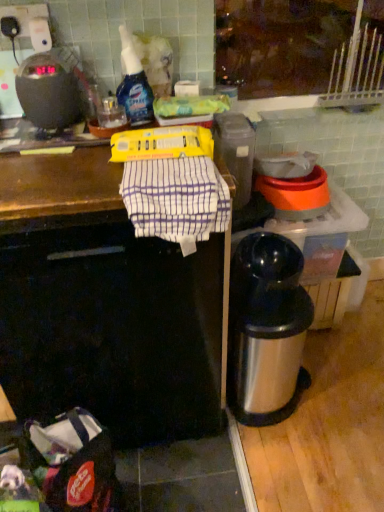
Question: From the image's perspective, would you say white striped cloth at center is positioned over silver metallic thermos at lower right?

Choices:
 (A) no
 (B) yes

Answer: (B)

Question: Is white striped cloth at center positioned beyond the bounds of silver metallic thermos at lower right?

Choices:
 (A) no
 (B) yes

Answer: (B)

Question: Does white striped cloth at center have a lesser width compared to silver metallic thermos at lower right?

Choices:
 (A) no
 (B) yes

Answer: (A)

Question: Is white striped cloth at center to the left of silver metallic thermos at lower right from the viewer's perspective?

Choices:
 (A) yes
 (B) no

Answer: (A)

Question: Is white striped cloth at center taller than silver metallic thermos at lower right?

Choices:
 (A) no
 (B) yes

Answer: (B)

Question: Is white striped cloth at center closer to the viewer compared to silver metallic thermos at lower right?

Choices:
 (A) no
 (B) yes

Answer: (B)

Question: Can you confirm if silver metallic thermos at lower right is bigger than black plastic scale at upper left?

Choices:
 (A) no
 (B) yes

Answer: (B)

Question: Is silver metallic thermos at lower right beside black plastic scale at upper left?

Choices:
 (A) yes
 (B) no

Answer: (B)

Question: Is silver metallic thermos at lower right at the left side of black plastic scale at upper left?

Choices:
 (A) yes
 (B) no

Answer: (B)

Question: Is black plastic scale at upper left located within silver metallic thermos at lower right?

Choices:
 (A) no
 (B) yes

Answer: (A)

Question: From a real-world perspective, does silver metallic thermos at lower right sit lower than black plastic scale at upper left?

Choices:
 (A) yes
 (B) no

Answer: (A)

Question: Does silver metallic thermos at lower right have a lesser width compared to black plastic scale at upper left?

Choices:
 (A) no
 (B) yes

Answer: (A)

Question: From a real-world perspective, is black plastic scale at upper left positioned over silver metallic thermos at lower right based on gravity?

Choices:
 (A) no
 (B) yes

Answer: (B)